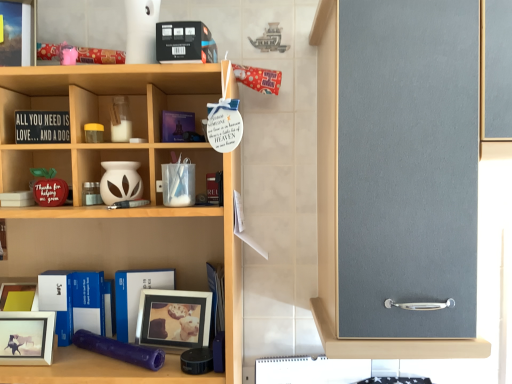
Question: Is black matte book at upper center, placed as the 6th book when sorted from bottom to top, inside blue hardcover book at center, which appears as the 4th book when viewed from the top?

Choices:
 (A) no
 (B) yes

Answer: (A)

Question: From the image's perspective, is blue hardcover book at center, marked as the 3th book in a bottom-to-top arrangement, below black matte book at upper center, the first book positioned from the top?

Choices:
 (A) yes
 (B) no

Answer: (A)

Question: Is blue hardcover book at center, which appears as the 4th book when viewed from the top, touching black matte book at upper center, placed as the 6th book when sorted from bottom to top?

Choices:
 (A) yes
 (B) no

Answer: (B)

Question: Considering the relative sizes of blue hardcover book at center, marked as the 3th book in a bottom-to-top arrangement, and black matte book at upper center, placed as the 6th book when sorted from bottom to top, in the image provided, is blue hardcover book at center, marked as the 3th book in a bottom-to-top arrangement, wider than black matte book at upper center, placed as the 6th book when sorted from bottom to top,?

Choices:
 (A) yes
 (B) no

Answer: (B)

Question: Is blue hardcover book at center, marked as the 3th book in a bottom-to-top arrangement, taller than black matte book at upper center, the first book positioned from the top?

Choices:
 (A) yes
 (B) no

Answer: (A)

Question: From a real-world perspective, relative to white matte picture frame at lower left, placed as the 2th picture frame when sorted from back to front, is matte black signboard at left, which ranks as the fifth book in bottom-to-top order, vertically above or below?

Choices:
 (A) above
 (B) below

Answer: (A)

Question: Choose the correct answer: Is matte black signboard at left, which ranks as the fifth book in bottom-to-top order, inside white matte picture frame at lower left, the 1th picture frame from the front, or outside it?

Choices:
 (A) outside
 (B) inside

Answer: (A)

Question: Is point (45, 112) positioned closer to the camera than point (48, 316)?

Choices:
 (A) closer
 (B) farther

Answer: (B)

Question: Considering the relative positions of matte black signboard at left, which appears as the 2th book when viewed from the top, and white matte picture frame at lower left, placed as the 2th picture frame when sorted from back to front, in the image provided, is matte black signboard at left, which appears as the 2th book when viewed from the top, to the left or to the right of white matte picture frame at lower left, placed as the 2th picture frame when sorted from back to front,?

Choices:
 (A) left
 (B) right

Answer: (B)

Question: Considering their positions, is blue hardcover book at center, which appears as the 4th book when viewed from the top, located in front of or behind wooden shelf at center?

Choices:
 (A) behind
 (B) front

Answer: (A)

Question: Is blue hardcover book at center, which appears as the 4th book when viewed from the top, wider or thinner than wooden shelf at center?

Choices:
 (A) wide
 (B) thin

Answer: (B)

Question: Do you think blue hardcover book at center, which appears as the 4th book when viewed from the top, is within wooden shelf at center, or outside of it?

Choices:
 (A) inside
 (B) outside

Answer: (A)

Question: Does point (209, 334) appear closer or farther from the camera than point (141, 382)?

Choices:
 (A) farther
 (B) closer

Answer: (A)

Question: From a real-world perspective, is blue matte book at lower left, which ranks as the first book in bottom-to-top order, physically located above or below blue hardcover book at center, which appears as the 4th book when viewed from the top?

Choices:
 (A) above
 (B) below

Answer: (B)

Question: Is blue matte book at lower left, which ranks as the first book in bottom-to-top order, bigger or smaller than blue hardcover book at center, marked as the 3th book in a bottom-to-top arrangement?

Choices:
 (A) big
 (B) small

Answer: (B)